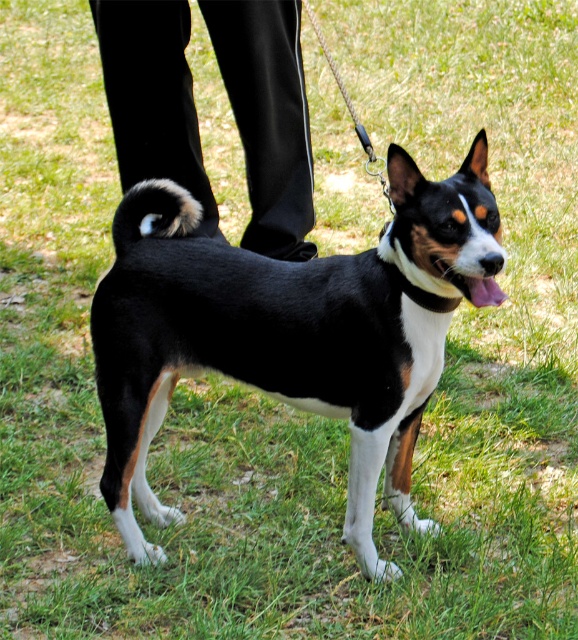
Question: Considering the relative positions of black and white fur dog at center and white fabric neckband at center in the image provided, where is black and white fur dog at center located with respect to white fabric neckband at center?

Choices:
 (A) below
 (B) above

Answer: (A)

Question: Among these objects, which one is nearest to the camera?

Choices:
 (A) white fabric neckband at center
 (B) fuzzy black tail at center

Answer: (A)

Question: Can you confirm if black and white fur dog at center is wider than pink glossy tongue at center?

Choices:
 (A) yes
 (B) no

Answer: (A)

Question: Is black smooth pants at lower center further to the viewer compared to fuzzy black tail at center?

Choices:
 (A) no
 (B) yes

Answer: (B)

Question: Which of the following is the farthest from the observer?

Choices:
 (A) white fabric neckband at center
 (B) black and white fur dog at center
 (C) pink glossy tongue at center
 (D) fuzzy black tail at center

Answer: (D)

Question: Estimate the real-world distances between objects in this image. Which object is closer to the pink glossy tongue at center?

Choices:
 (A) black smooth pants at lower center
 (B) fuzzy black tail at center

Answer: (B)